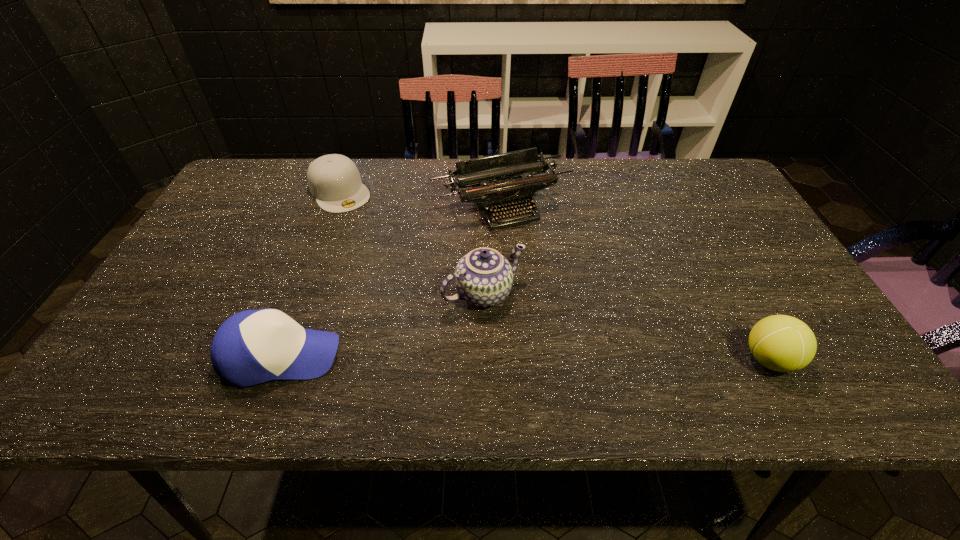
Identify the location of baseball cap. (251, 347).

Find the location of a particular element. the rightmost object is located at coordinates (782, 343).

Identify the location of typewriter. The height and width of the screenshot is (540, 960). (513, 185).

Find the location of a particular element. The width and height of the screenshot is (960, 540). cap is located at coordinates (334, 180).

Where is `chinaware`? This screenshot has width=960, height=540. chinaware is located at coordinates (483, 277).

Image resolution: width=960 pixels, height=540 pixels. I want to click on vacant region located on the front-facing side of the baseball cap, so click(x=533, y=356).

Locate an element on the screen. free spot located 0.280m on the back of the rightmost object is located at coordinates (710, 249).

Where is `free point located 0.210m on the typing side of the typewriter`? The image size is (960, 540). free point located 0.210m on the typing side of the typewriter is located at coordinates (557, 286).

Locate an element on the screen. vacant space located on the typing side of the typewriter is located at coordinates (548, 272).

The image size is (960, 540). Identify the location of free location located 0.170m on the typing side of the typewriter. (550, 274).